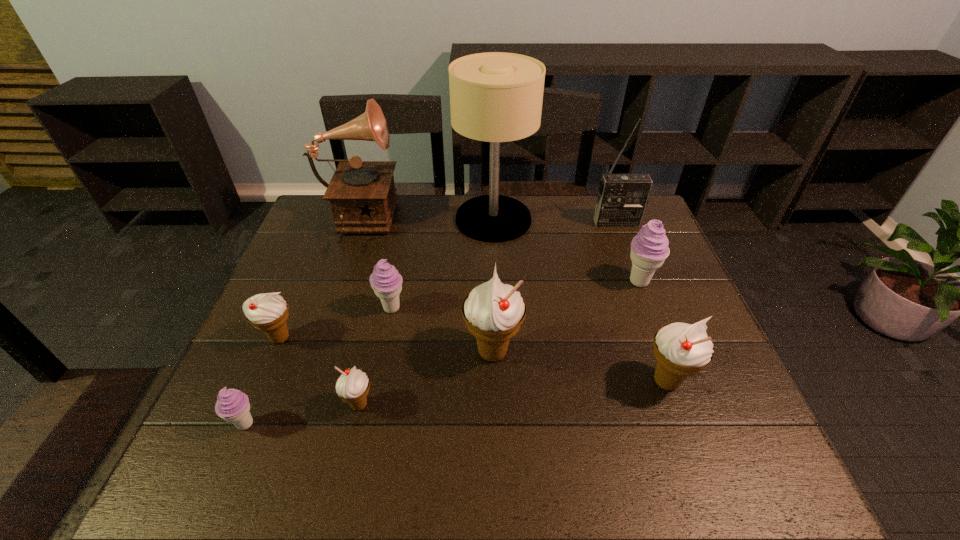
This screenshot has height=540, width=960. Identify the location of the second purple icecream from left to right. (385, 280).

In order to click on the sixth nearest icecream in this screenshot , I will do `click(385, 280)`.

You are a GUI agent. You are given a task and a screenshot of the screen. Output one action in this format:
    pyautogui.click(x=<x>, y=<y>)
    Task: Click on the second white icecream from left to right
    The width and height of the screenshot is (960, 540).
    Given the screenshot: What is the action you would take?
    pyautogui.click(x=353, y=385)

This screenshot has width=960, height=540. What are the coordinates of `the nearest purple icecream` in the screenshot? It's located at (232, 405).

The image size is (960, 540). I want to click on the leftmost purple icecream, so click(x=232, y=405).

Where is `vacant space located on the left of the beige table lamp`? vacant space located on the left of the beige table lamp is located at coordinates (397, 219).

Where is `free space located on the horn of the brown record player`? free space located on the horn of the brown record player is located at coordinates (488, 226).

Where is `vacant space situated 0.280m on the display of the radio receiver`? This screenshot has width=960, height=540. vacant space situated 0.280m on the display of the radio receiver is located at coordinates (642, 289).

This screenshot has width=960, height=540. What are the coordinates of `free space located on the left of the second white icecream from right to left` in the screenshot? It's located at click(296, 352).

Identify the location of free point located 0.110m on the front of the seventh nearest object. (656, 325).